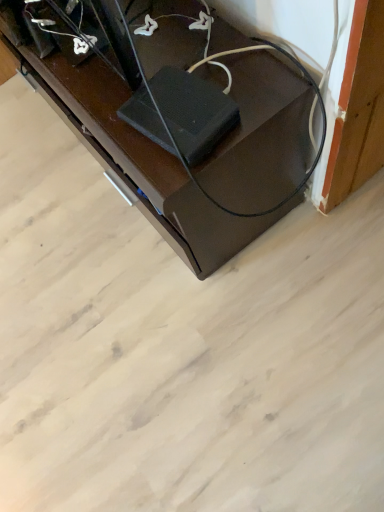
The width and height of the screenshot is (384, 512). Identify the location of free spot to the left of black glossy speaker at lower right. (44, 210).